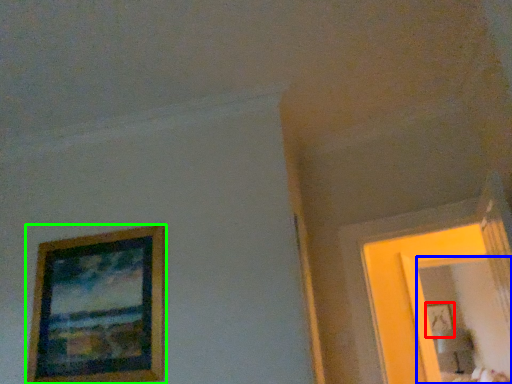
Question: Estimate the real-world distances between objects in this image. Which object is closer to picture frame (highlighted by a red box), mirror (highlighted by a blue box) or picture frame (highlighted by a green box)?

Choices:
 (A) mirror
 (B) picture frame

Answer: (A)